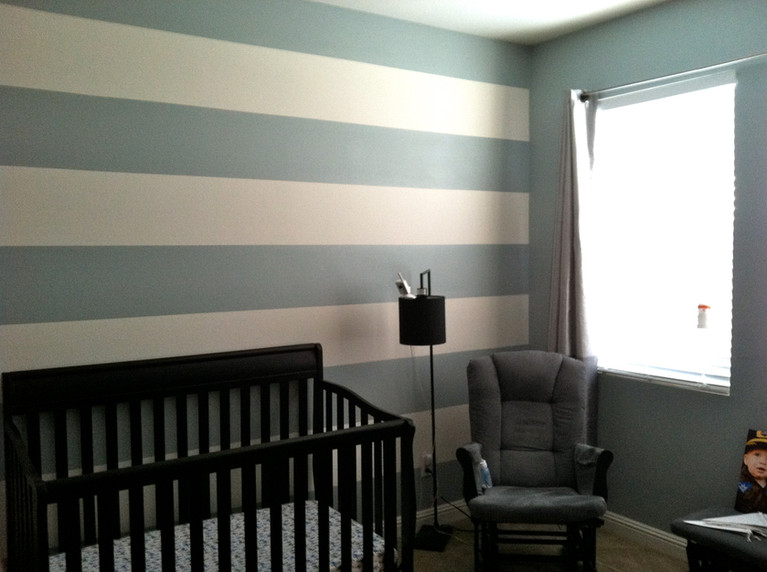
Find the location of a particular element. The width and height of the screenshot is (767, 572). electrical outlet is located at coordinates (423, 472).